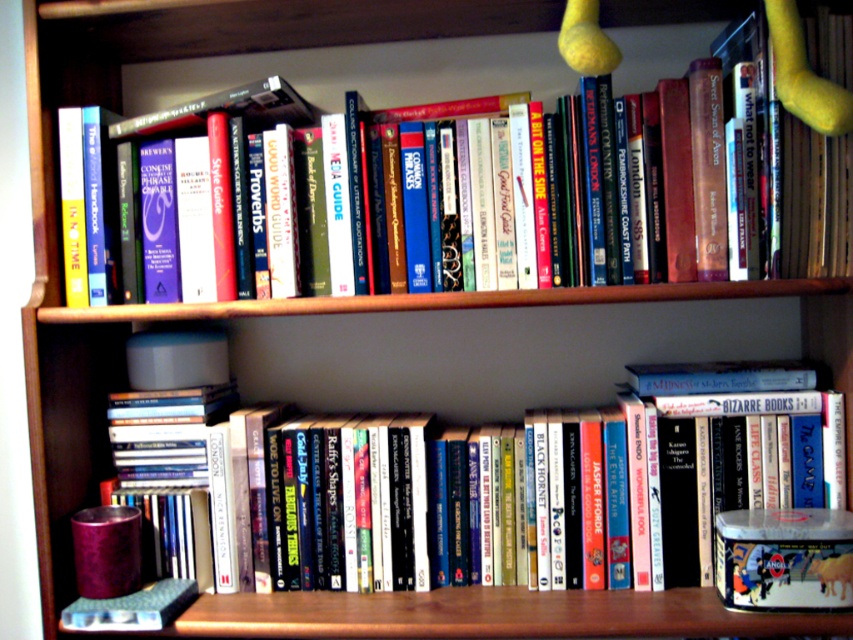
You are standing in front of the wooden bookshelf. There is a hardcover book located at point (347, 502). Can you confirm if this book is on the top shelf or the bottom shelf?

The hardcover book at point (347, 502) is on the bottom shelf because the bottom shelf has a mix of books and other items, while the top shelf is more organized with books only.

You have a small box that is 10 cm wide. You want to place it between the hardcover book at lower center and the hardcover book at upper center on the bookshelf. Based on their widths, can the box fit in the space between them?

The hardcover book at lower center is narrower than the hardcover book at upper center. The space between them may vary depending on their positions, but since the box is only 10 cm wide, it might fit if the gap is sufficient. However, without knowing the exact distance between the books, we cannot confirm for certain.

You are standing in front of the wooden bookshelf and want to place a new book between the two points, point (753, 486) and point (370, 3). Which point should you place the new book closer to so that it is in front of the other point?

You should place the new book closer to point (753, 486) because it is in front of point (370, 3).